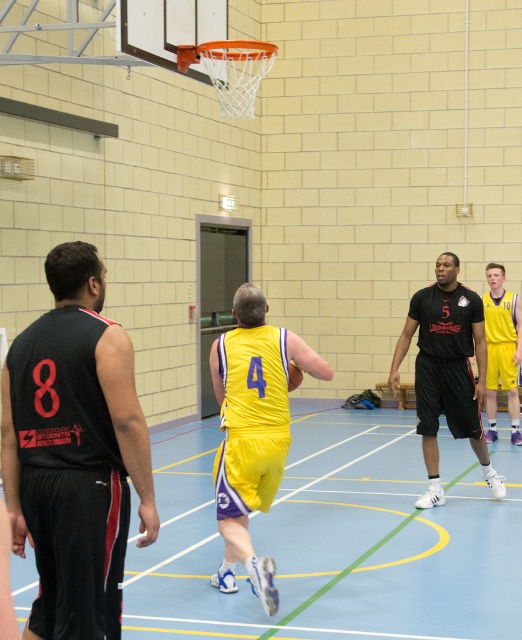
Is point (272, 400) behind point (506, 324)?

No.

Is point (254, 346) in front of point (506, 387)?

Yes, point (254, 346) is closer to viewer.

The width and height of the screenshot is (522, 640). Identify the location of yellow fabric jersey at center. (253, 429).

Can you confirm if yellow jersey at center is positioned to the left of yellow jersey at right?

Yes, yellow jersey at center is to the left of yellow jersey at right.

At what (x,y) coordinates should I click in order to perform the action: click on yellow jersey at center. Please return your answer as a coordinate pair (x, y). Looking at the image, I should click on (330, 541).

Does yellow jersey at center appear under black matte basketball jersey at center?

Indeed, yellow jersey at center is positioned under black matte basketball jersey at center.

The width and height of the screenshot is (522, 640). I want to click on yellow jersey at center, so click(330, 541).